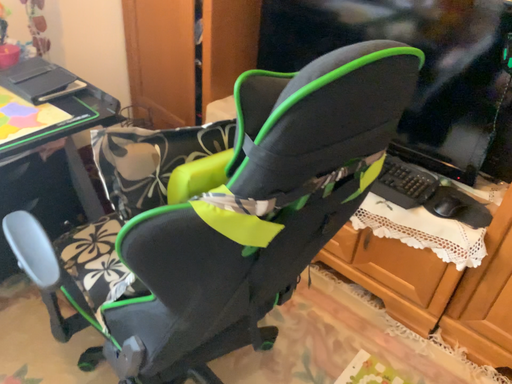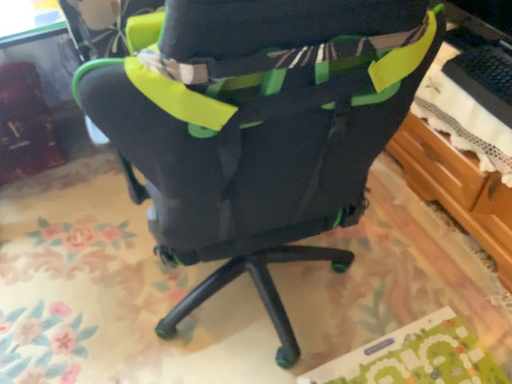
Question: How did the camera likely rotate when shooting the video?

Choices:
 (A) rotated left
 (B) rotated right

Answer: (A)